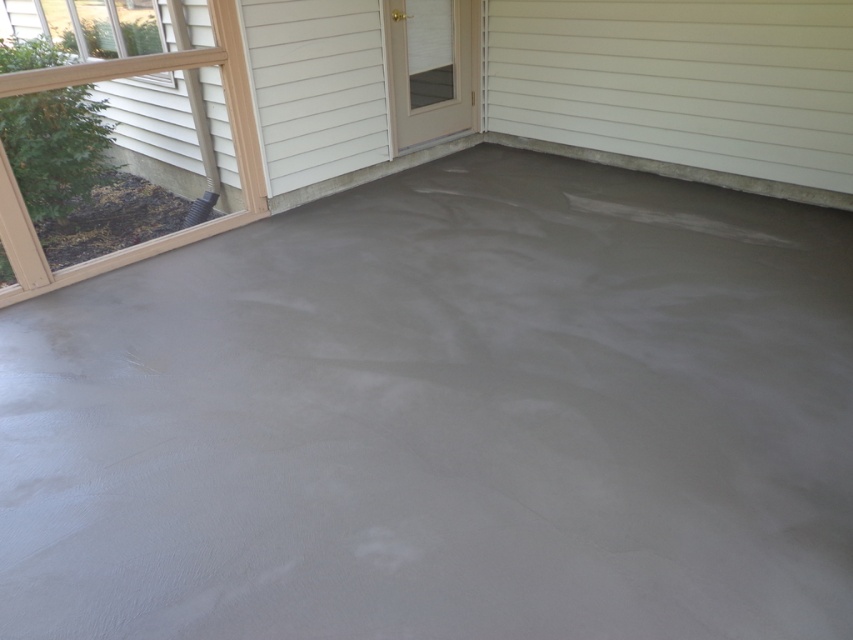
In the scene shown: You are a delivery person trying to enter the house through the clear glass screen door at center. However, your delivery cart is currently on the smooth concrete floor at center. Can you move the cart directly to the door without moving around any obstacles?

The smooth concrete floor at center is to the left of clear glass screen door at center, so there are no obstacles between them. Therefore, you can move the cart directly to the door without any issues.

Consider the image. You are a delivery person trying to bring a large sofa through the clear glass screen door at center into the house. The sofa is as wide as the smooth concrete floor at center. Will the sofa fit through the door?

The smooth concrete floor at center is wider than the clear glass screen door at center. Since the sofa is as wide as the smooth concrete floor at center, it will not fit through the clear glass screen door at center because it is wider than the door.

You are a contractor inspecting the freshly poured concrete floor. You notice the smooth concrete floor at center and the clear glass screen door at center. Which object is closer to you?

The smooth concrete floor at center is closer to the viewer than the clear glass screen door at center.